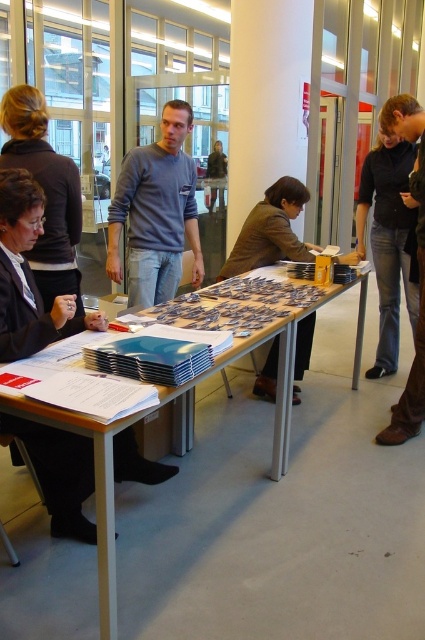
You are a guest at an event and need to find the wooden table at center where the registration forms are placed. From your current position at the dark brown hair at upper left, which direction should you move to reach it?

The wooden table at center is located below dark brown hair at upper left, so you should move downward from the dark brown hair at upper left to reach it.

You are organizing a meeting and need to place a name tag on the table. The name tag is the same size as the matte gray sweater at center. Will it fit on the space where the brown fabric jacket at center is currently placed?

The brown fabric jacket at center is larger in size than the matte gray sweater at center. Since the name tag is the same size as the sweater, it will fit in the space occupied by the jacket.